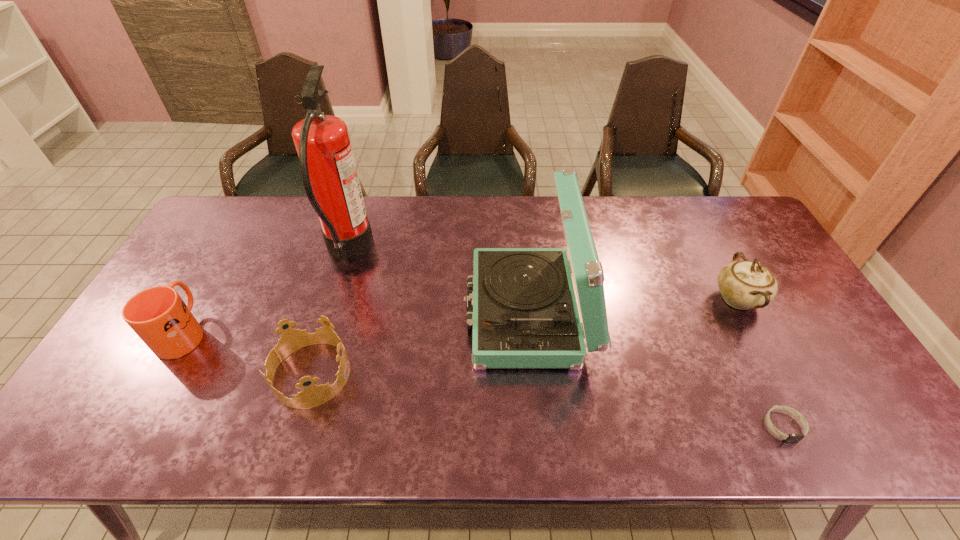
Where is `fire extinguisher`? This screenshot has height=540, width=960. fire extinguisher is located at coordinates pos(328,170).

This screenshot has width=960, height=540. In order to click on the fifth shortest object in this screenshot , I will do `click(523, 309)`.

The image size is (960, 540). I want to click on the fourth object from left to right, so click(523, 309).

What are the coordinates of `chinaware` in the screenshot? It's located at (744, 285).

Locate an element on the screen. The width and height of the screenshot is (960, 540). mug is located at coordinates (158, 315).

Image resolution: width=960 pixels, height=540 pixels. Find the location of `tiara`. tiara is located at coordinates pos(291,340).

The height and width of the screenshot is (540, 960). What are the coordinates of `the shortest object` in the screenshot? It's located at (791, 437).

Find the location of a particular element. wristband is located at coordinates (791, 437).

The width and height of the screenshot is (960, 540). What are the coordinates of `vacant space positioned on the front-facing side of the tallest object` in the screenshot? It's located at (486, 252).

Find the location of a particular element. The height and width of the screenshot is (540, 960). vacant area situated on the face side of the second tallest object is located at coordinates (419, 313).